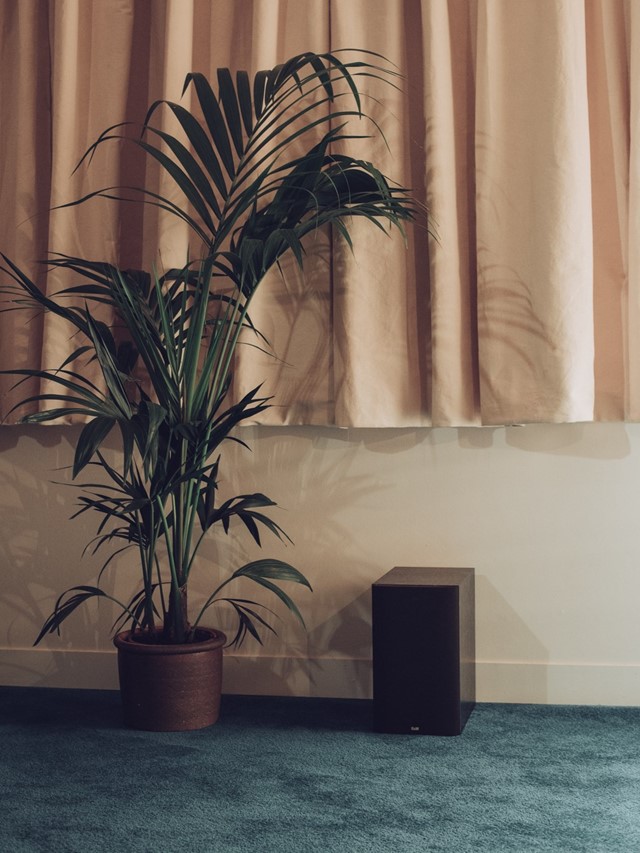
This screenshot has height=853, width=640. Identify the location of speaker. (444, 670).